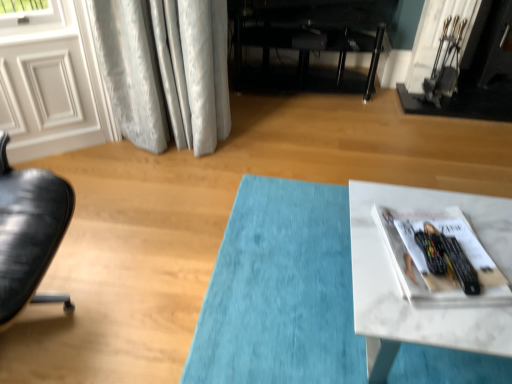
At what (x,y) coordinates should I click in order to perform the action: click on free point below white glossy magazine at lower right (from a real-world perspective). Please return your answer as a coordinate pair (x, y). This screenshot has width=512, height=384. Looking at the image, I should click on (437, 243).